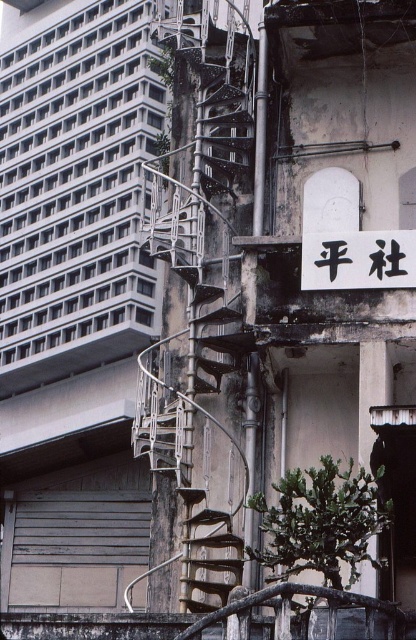
You are an architect assessing the building for renovation. You need to determine if the black matte sign at upper center can be moved to the space currently occupied by the rusty metal fire escape at center. Based on their sizes, will the sign fit without requiring structural adjustments?

The rusty metal fire escape at center is wider than the black matte sign at upper center. Since the fire escape is larger in width, the sign would fit in its place without needing structural changes.

You are an architect analyzing the building facade. You notice the rusty metal fire escape at center and the black matte sign at upper center. Which object occupies more vertical space on the building wall?

The rusty metal fire escape at center has a greater height compared to the black matte sign at upper center, so it occupies more vertical space on the building wall.

You are an architect analyzing the building facade. You notice the rusty metal fire escape at center and the black matte sign at upper center. Which object takes up more visual space on the wall?

The rusty metal fire escape at center has a larger size compared to the black matte sign at upper center, so it takes up more visual space on the wall.